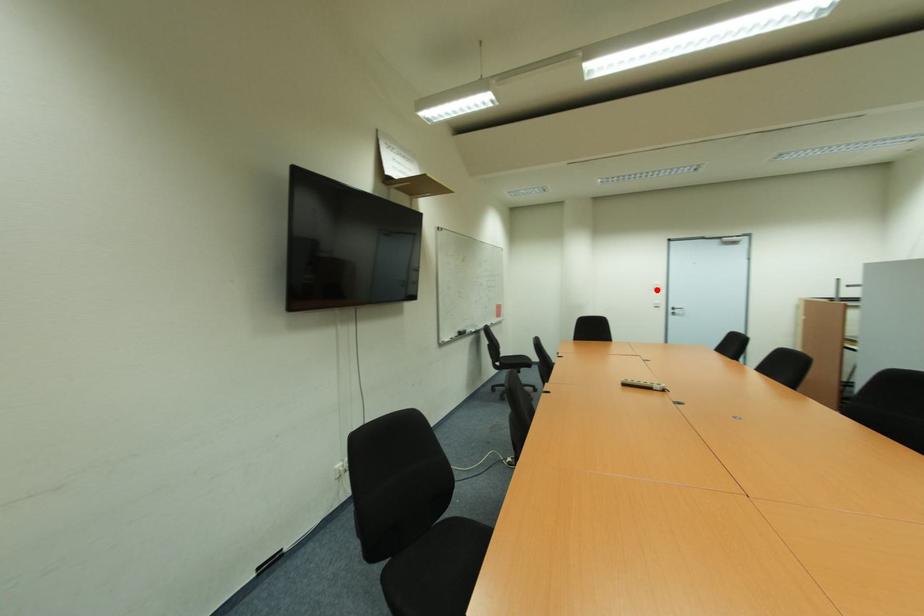
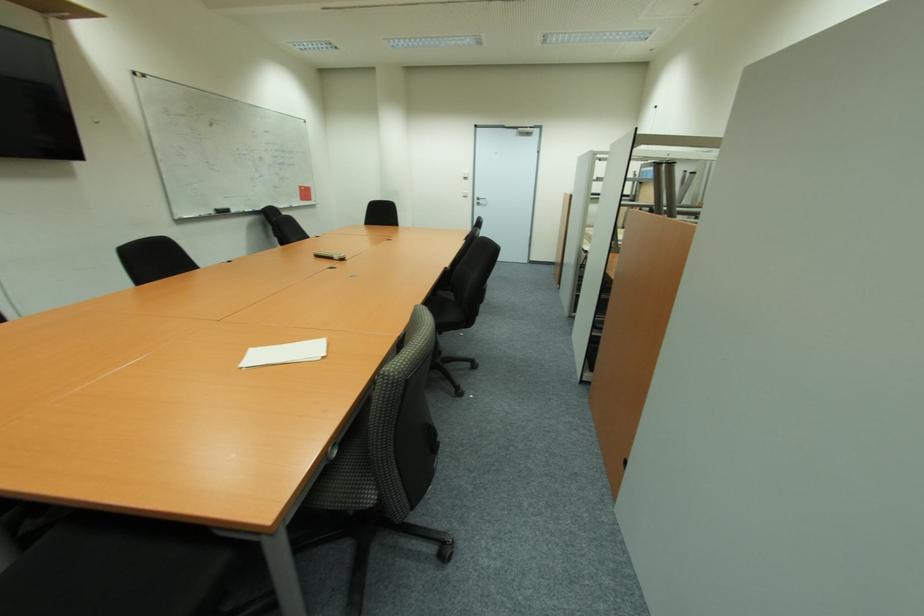
Find the pixel in the second image that matches the highlighted location in the first image.

(467, 179)